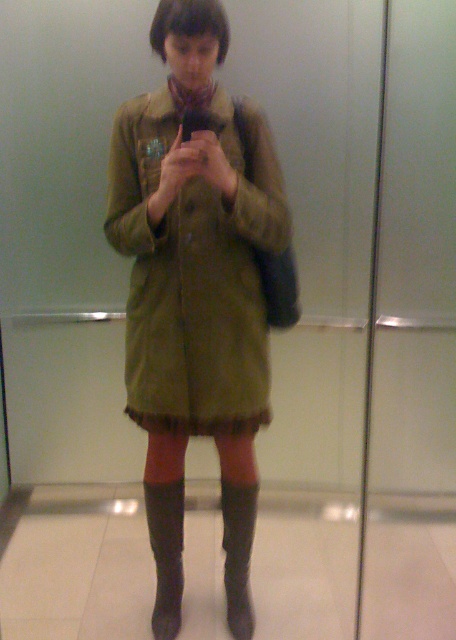
Is olive green fabric jacket at center bigger than leather at lower center?

Correct, olive green fabric jacket at center is larger in size than leather at lower center.

Is point (164, 100) behind point (154, 509)?

No, it is not.

What are the coordinates of `olive green fabric jacket at center` in the screenshot? It's located at (195, 273).

Is olive green fabric jacket at center bigger than leather/knit boot at lower center?

Indeed, olive green fabric jacket at center has a larger size compared to leather/knit boot at lower center.

Can you confirm if olive green fabric jacket at center is positioned below leather/knit boot at lower center?

No, olive green fabric jacket at center is not below leather/knit boot at lower center.

Is point (119, 115) in front of point (237, 490)?

Yes, it is.

At what (x,y) coordinates should I click in order to perform the action: click on olive green fabric jacket at center. Please return your answer as a coordinate pair (x, y). Looking at the image, I should click on (195, 273).

Is leather at lower center bigger than leather/knit boot at lower center?

No.

Locate an element on the screen. leather at lower center is located at coordinates (165, 554).